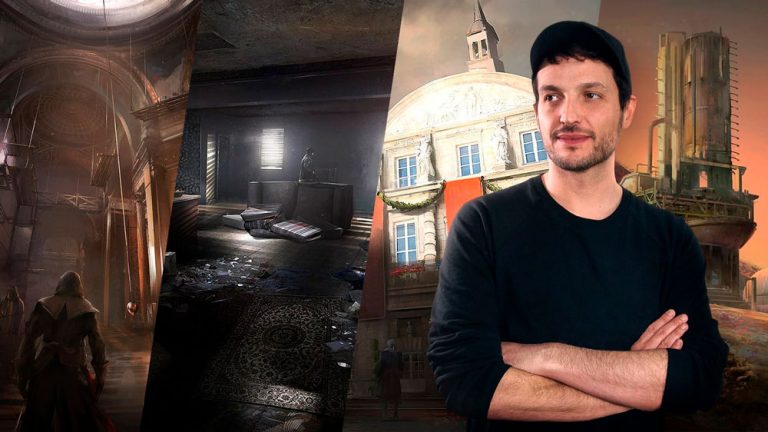
Locate an element on the screen. The height and width of the screenshot is (432, 768). archway is located at coordinates (78, 86).